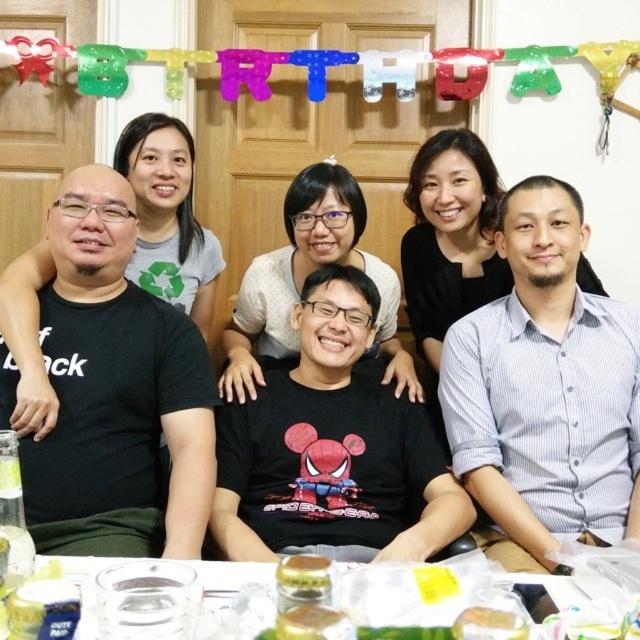
You are a photographer taking a picture of the black matte shirt at center and the translucent plastic container at lower center. Which object should you focus on first to ensure both are in frame?

The black matte shirt at center is much taller than the translucent plastic container at lower center, so you should focus on the black matte shirt at center first to ensure both are in frame.

You are a guest at the birthday party and need to place a small gift on the table. Which object from the transparent plastic table at lower center or the translucent plastic container at lower center should you choose to place the gift on?

You should place the gift on the transparent plastic table at lower center because it is much taller than the translucent plastic container at lower center, making it more stable and suitable for placing items.